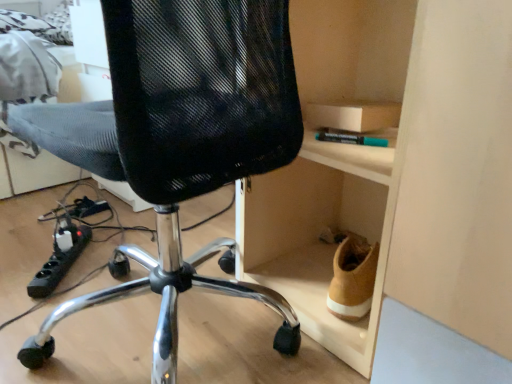
Question: From the image's perspective, would you say wooden cabinet at right is positioned over black mesh chair at center?

Choices:
 (A) no
 (B) yes

Answer: (B)

Question: Is the position of wooden cabinet at right more distant than that of black mesh chair at center?

Choices:
 (A) no
 (B) yes

Answer: (B)

Question: Is wooden cabinet at right looking in the opposite direction of black mesh chair at center?

Choices:
 (A) yes
 (B) no

Answer: (B)

Question: Are wooden cabinet at right and black mesh chair at center located far from each other?

Choices:
 (A) yes
 (B) no

Answer: (B)

Question: Does wooden cabinet at right have a smaller size compared to black mesh chair at center?

Choices:
 (A) yes
 (B) no

Answer: (A)

Question: Is black mesh chair at center located within wooden cabinet at right?

Choices:
 (A) no
 (B) yes

Answer: (A)

Question: From a real-world perspective, is wooden cabinet at right over black plastic power strip at lower left?

Choices:
 (A) yes
 (B) no

Answer: (A)

Question: Can you confirm if wooden cabinet at right is thinner than black plastic power strip at lower left?

Choices:
 (A) no
 (B) yes

Answer: (A)

Question: Are wooden cabinet at right and black plastic power strip at lower left far apart?

Choices:
 (A) no
 (B) yes

Answer: (A)

Question: Can we say wooden cabinet at right lies outside black plastic power strip at lower left?

Choices:
 (A) yes
 (B) no

Answer: (A)

Question: Considering the relative positions of wooden cabinet at right and black plastic power strip at lower left in the image provided, is wooden cabinet at right to the left of black plastic power strip at lower left from the viewer's perspective?

Choices:
 (A) yes
 (B) no

Answer: (B)

Question: Does wooden cabinet at right have a greater width compared to black plastic power strip at lower left?

Choices:
 (A) no
 (B) yes

Answer: (B)

Question: Does black mesh chair at center have a lesser width compared to wooden cabinet at right?

Choices:
 (A) yes
 (B) no

Answer: (B)